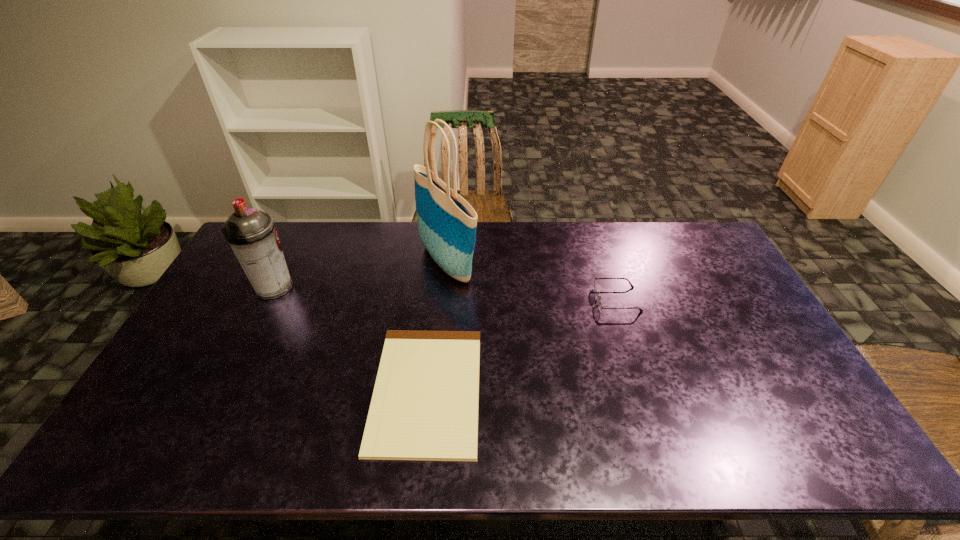
Where is `free space between the second tallest object and the tallest object`? free space between the second tallest object and the tallest object is located at coordinates (360, 275).

This screenshot has width=960, height=540. I want to click on vacant point located between the nearest object and the second shortest object, so click(522, 345).

Identify the location of empty space between the third tallest object and the shortest object. This screenshot has width=960, height=540. (522, 345).

I want to click on blank region between the tallest object and the shortest object, so click(x=437, y=326).

Locate an element on the screen. vacant region between the aerosol can and the third tallest object is located at coordinates (445, 293).

Locate an element on the screen. Image resolution: width=960 pixels, height=540 pixels. empty space that is in between the third tallest object and the clipboard is located at coordinates (522, 345).

Find the location of a particular element. Image resolution: width=960 pixels, height=540 pixels. free space between the tote bag and the second tallest object is located at coordinates (360, 275).

Where is `empty location between the clipboard and the tote bag`? The height and width of the screenshot is (540, 960). empty location between the clipboard and the tote bag is located at coordinates point(437,326).

Find the location of a particular element. vacant area that lies between the aerosol can and the tote bag is located at coordinates tap(360, 275).

Where is `free space that is in between the aerosol can and the rightmost object`? free space that is in between the aerosol can and the rightmost object is located at coordinates (445, 293).